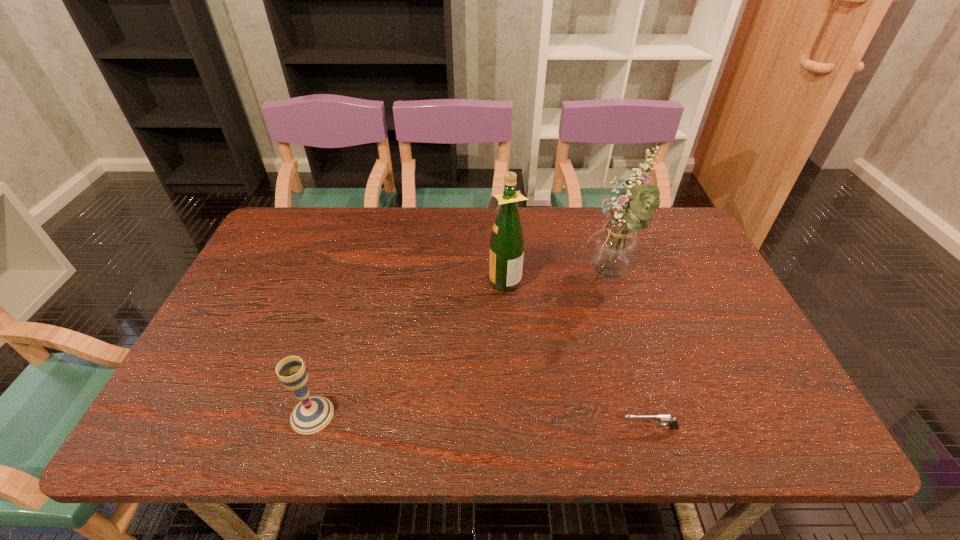
Find the location of a particular element. bouquet is located at coordinates (615, 247).

Find the location of a particular element. the second object from left to right is located at coordinates (507, 240).

Where is `liquor`? liquor is located at coordinates (507, 240).

Locate an element on the screen. chalice is located at coordinates (312, 414).

You are a GUI agent. You are given a task and a screenshot of the screen. Output one action in this format:
    pyautogui.click(x=<x>, y=<y>)
    Task: Click on the leftmost object
    This screenshot has height=540, width=960.
    Given the screenshot: What is the action you would take?
    pyautogui.click(x=312, y=414)

You are a GUI agent. You are given a task and a screenshot of the screen. Output one action in this format:
    pyautogui.click(x=<x>, y=<y>)
    Task: Click on the pistol
    The width and height of the screenshot is (960, 540).
    Given the screenshot: What is the action you would take?
    pyautogui.click(x=662, y=419)

At what (x,y) coordinates should I click in order to perform the action: click on vacant space positioned on the front-facing side of the bouquet. Please return your answer as a coordinate pair (x, y). Looking at the image, I should click on (564, 279).

Where is `vacant position located on the front-facing side of the bouquet`? This screenshot has height=540, width=960. vacant position located on the front-facing side of the bouquet is located at coordinates (483, 279).

This screenshot has height=540, width=960. What are the coordinates of `vacant region located on the front-facing side of the bouquet` in the screenshot? It's located at (511, 279).

The height and width of the screenshot is (540, 960). What are the coordinates of `vacant space located 0.320m on the front-facing side of the liquor` in the screenshot? It's located at (372, 279).